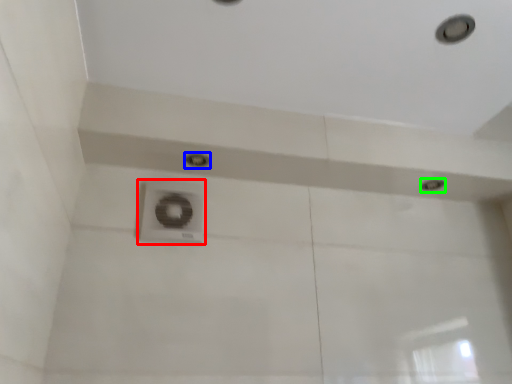
Question: Which object is the closest to the plumbing fixture (highlighted by a red box)? Choose among these: droplight (highlighted by a blue box) or droplight (highlighted by a green box).

Choices:
 (A) droplight
 (B) droplight

Answer: (A)